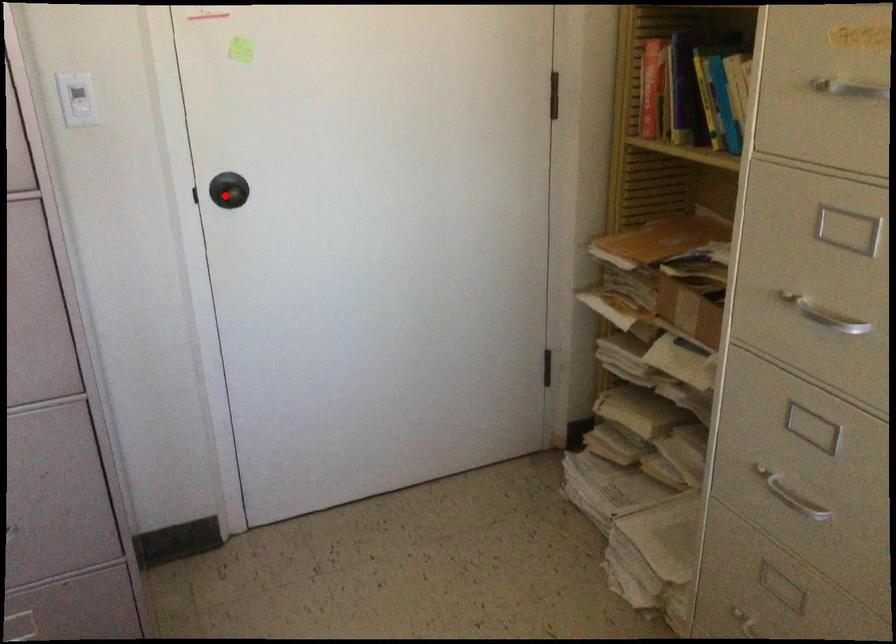
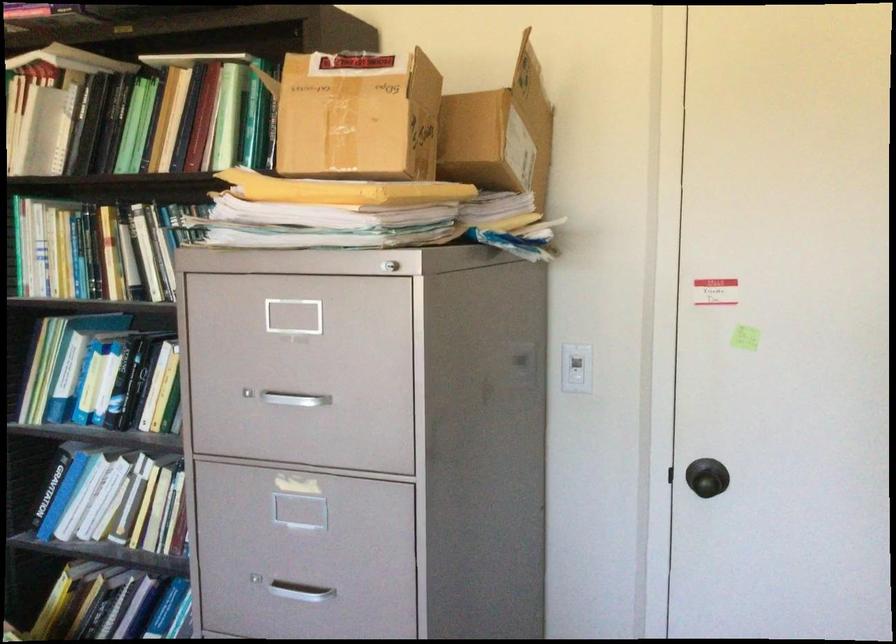
The point at the highlighted location is marked in the first image. Where is the corresponding point in the second image?

(707, 482)